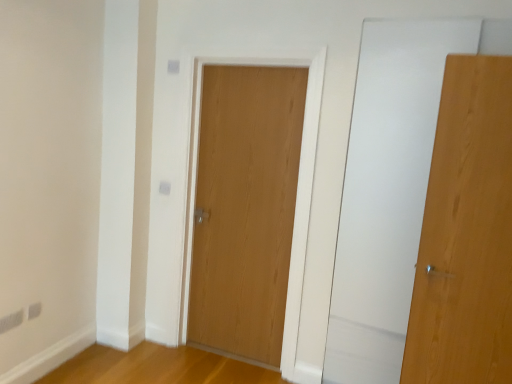
Question: From a real-world perspective, is light oak wood door at center, placed as the first door when sorted from left to right, beneath natural wood door at right, which appears as the 1th door when viewed from the right?

Choices:
 (A) yes
 (B) no

Answer: (A)

Question: Does light oak wood door at center, placed as the first door when sorted from left to right, come behind natural wood door at right, acting as the 1th door starting from the front?

Choices:
 (A) no
 (B) yes

Answer: (B)

Question: Is light oak wood door at center, placed as the first door when sorted from left to right, completely or partially outside of natural wood door at right, the second door positioned from the back?

Choices:
 (A) yes
 (B) no

Answer: (A)

Question: Considering the relative sizes of light oak wood door at center, placed as the first door when sorted from back to front, and natural wood door at right, the second door positioned from the back, in the image provided, is light oak wood door at center, placed as the first door when sorted from back to front, taller than natural wood door at right, the second door positioned from the back,?

Choices:
 (A) no
 (B) yes

Answer: (B)

Question: From a real-world perspective, is light oak wood door at center, placed as the first door when sorted from left to right, physically above natural wood door at right, placed as the 2th door when sorted from left to right?

Choices:
 (A) yes
 (B) no

Answer: (B)

Question: Does light oak wood door at center, placed as the first door when sorted from back to front, appear on the right side of natural wood door at right, placed as the 2th door when sorted from left to right?

Choices:
 (A) yes
 (B) no

Answer: (B)

Question: Is light oak wood door at center, which is the 2th door from front to back, surrounded by natural wood door at right, the second door positioned from the back?

Choices:
 (A) no
 (B) yes

Answer: (A)

Question: Is natural wood door at right, which appears as the 1th door when viewed from the right, further to camera compared to light oak wood door at center, placed as the first door when sorted from back to front?

Choices:
 (A) no
 (B) yes

Answer: (A)

Question: From the image's perspective, would you say natural wood door at right, the second door positioned from the back, is shown under light oak wood door at center, which is the 2th door from front to back?

Choices:
 (A) yes
 (B) no

Answer: (A)

Question: Considering the relative positions of natural wood door at right, the second door positioned from the back, and light oak wood door at center, placed as the first door when sorted from back to front, in the image provided, is natural wood door at right, the second door positioned from the back, to the left of light oak wood door at center, placed as the first door when sorted from back to front, from the viewer's perspective?

Choices:
 (A) yes
 (B) no

Answer: (B)

Question: Is there a large distance between natural wood door at right, placed as the 2th door when sorted from left to right, and light oak wood door at center, placed as the first door when sorted from left to right?

Choices:
 (A) no
 (B) yes

Answer: (B)

Question: Is natural wood door at right, which appears as the 1th door when viewed from the right, at the right side of light oak wood door at center, placed as the first door when sorted from back to front?

Choices:
 (A) yes
 (B) no

Answer: (A)

Question: From their relative heights in the image, would you say light oak wood door at center, placed as the first door when sorted from back to front, is taller or shorter than natural wood door at right, the second door positioned from the back?

Choices:
 (A) tall
 (B) short

Answer: (A)